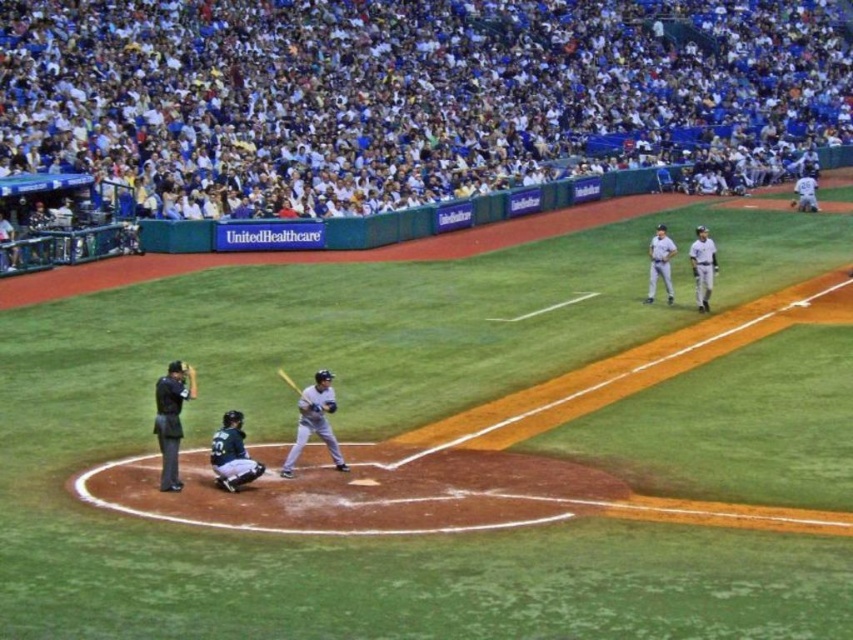
Question: Among these objects, which one is farthest from the camera?

Choices:
 (A) white fabric crowd at upper center
 (B) white uniformed player at upper right
 (C) dark gray matte uniform at lower center

Answer: (B)

Question: Which object appears closest to the camera in this image?

Choices:
 (A) dark gray matte uniform at lower center
 (B) gray uniformed player at center
 (C) gray matte uniform at center
 (D) dark brown leather glove at center

Answer: (B)

Question: Does white uniform at right have a larger size compared to dark brown leather glove at center?

Choices:
 (A) yes
 (B) no

Answer: (A)

Question: Which of the following is the farthest from the observer?

Choices:
 (A) dark gray matte uniform at lower center
 (B) black fabric umpire at left
 (C) gray matte uniform at center

Answer: (C)

Question: Is gray uniformed player at center bigger than dark brown leather glove at center?

Choices:
 (A) yes
 (B) no

Answer: (A)

Question: Can you confirm if gray matte uniform at center is positioned to the left of white uniform at right?

Choices:
 (A) yes
 (B) no

Answer: (A)